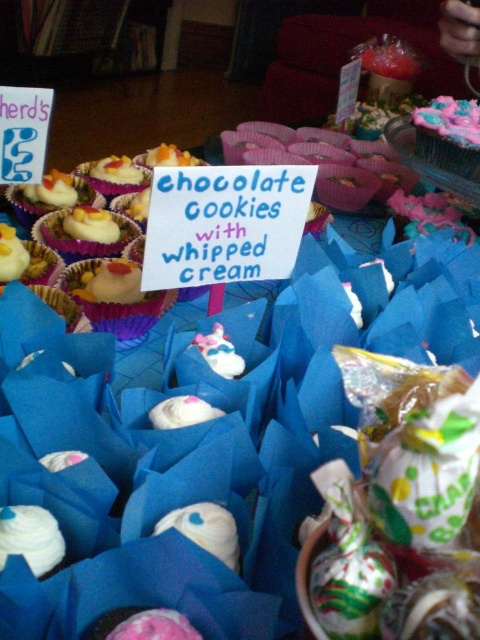
Question: Can you confirm if white frosted cupcake at center is positioned below matte white cupcake at center?

Choices:
 (A) no
 (B) yes

Answer: (A)

Question: In this image, where is white frosted cupcake at center located relative to matte white cupcake at center?

Choices:
 (A) above
 (B) below

Answer: (A)

Question: Is white frosted cupcake at center positioned before matte white cupcake at center?

Choices:
 (A) no
 (B) yes

Answer: (B)

Question: Among these points, which one is nearest to the camera?

Choices:
 (A) (179, 148)
 (B) (94, 291)

Answer: (B)

Question: Which object is farther from the camera taking this photo?

Choices:
 (A) white frosted cupcake at center
 (B) matte white cupcake at center
 (C) matte white cupcake at upper left

Answer: (C)

Question: Which point is closer to the camera taking this photo?

Choices:
 (A) (154, 308)
 (B) (134, 296)
 (C) (84, 232)

Answer: (A)